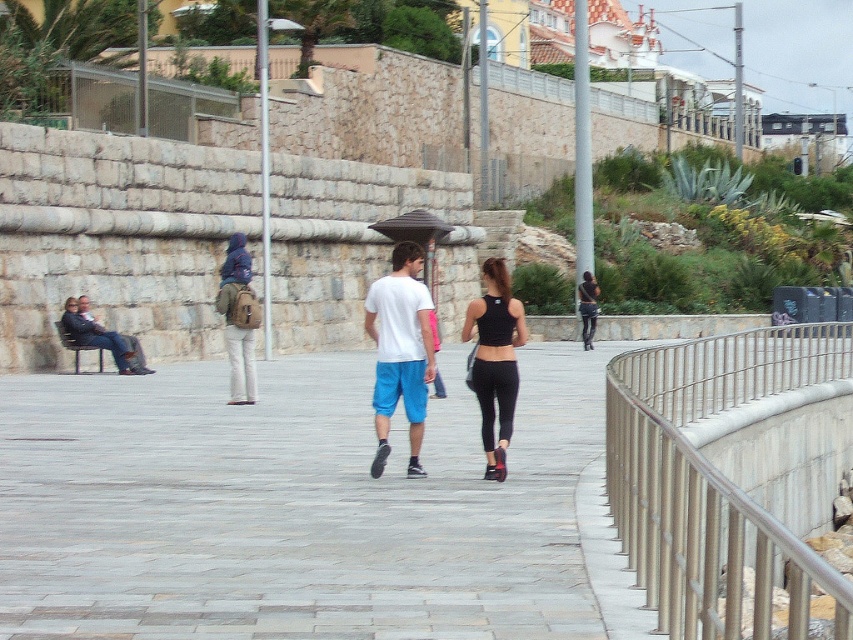
You are a photographer standing on the walkway. You want to capture a photo of the black fabric umbrella at center and the black leather pants at center. Which object should you zoom in on to ensure both fit in the frame without cropping?

You should zoom in on the black leather pants at center because its width is smaller than the black fabric umbrella at center, allowing both to fit within the frame when zoomed appropriately.

You are a delivery drone with a maximum flight range of 60 feet. You need to deliver a package from the matte brown backpack at center to the black leather pants at center. Can you complete the delivery without needing a recharge?

The distance between the matte brown backpack at center and the black leather pants at center is 65.88 feet, which exceeds the drone s 60 feet maximum range. Therefore, the drone cannot complete the delivery without recharging.